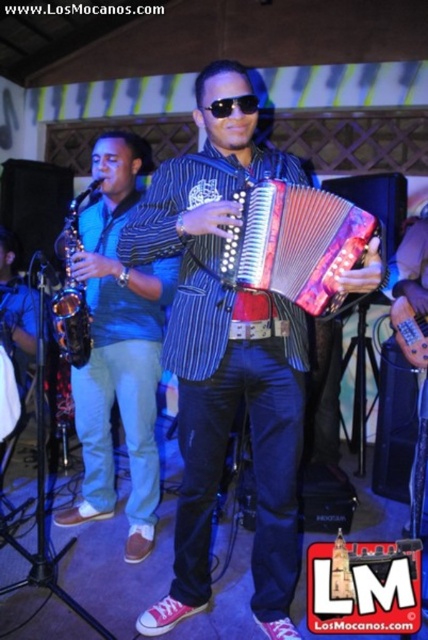
In the scene shown: Between brushed metal saxophone at left and satin gold saxophone at left, which one has less height?

satin gold saxophone at left

Consider the image. Which of these two, brushed metal saxophone at left or satin gold saxophone at left, stands taller?

brushed metal saxophone at left

Is point (154, 502) closer to viewer compared to point (68, 342)?

No.

You are a GUI agent. You are given a task and a screenshot of the screen. Output one action in this format:
    pyautogui.click(x=<x>, y=<y>)
    Task: Click on the brushed metal saxophone at left
    
    Given the screenshot: What is the action you would take?
    pyautogui.click(x=118, y=348)

Which of these two, brushed metal saxophone at left or shiny metallic accordion at center, stands taller?

Standing taller between the two is brushed metal saxophone at left.

Is brushed metal saxophone at left shorter than shiny metallic accordion at center?

In fact, brushed metal saxophone at left may be taller than shiny metallic accordion at center.

At what (x,y) coordinates should I click in order to perform the action: click on brushed metal saxophone at left. Please return your answer as a coordinate pair (x, y). The width and height of the screenshot is (428, 640). Looking at the image, I should click on (118, 348).

Looking at this image, between satin gold saxophone at left and black plastic sunglasses at center, which one is positioned higher?

black plastic sunglasses at center

Is satin gold saxophone at left wider than black plastic sunglasses at center?

Yes.

Which is in front, point (68, 262) or point (246, 109)?

Positioned in front is point (246, 109).

Identify the location of satin gold saxophone at left. The height and width of the screenshot is (640, 428). (71, 291).